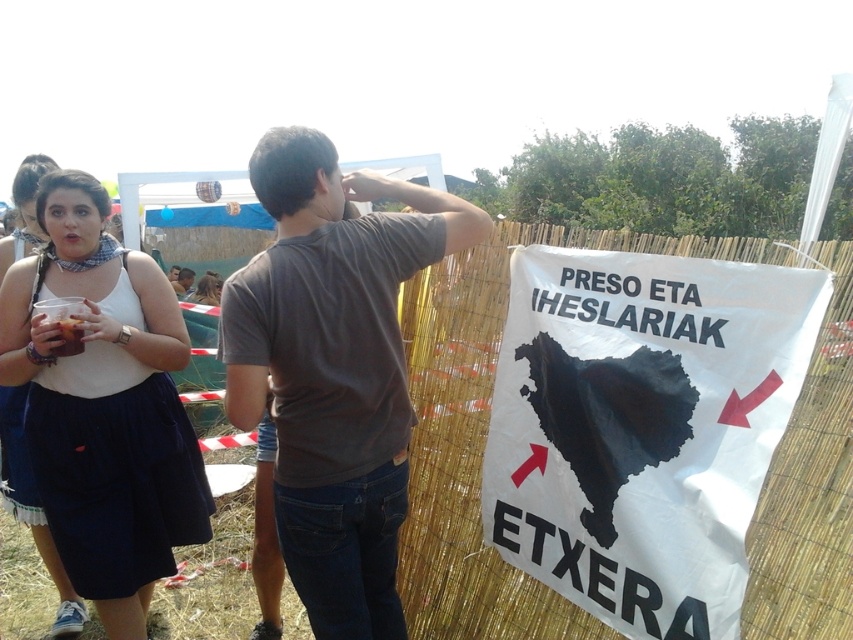
Is dark gray t-shirt at center behind white cotton tank top at left?

No.

Between point (302, 211) and point (26, 387), which one is positioned behind?

Point (26, 387)

Who is more distant from viewer, [445,240] or [33,244]?

The point [33,244] is more distant.

Where is `dark gray t-shirt at center`? Image resolution: width=853 pixels, height=640 pixels. dark gray t-shirt at center is located at coordinates (334, 369).

Who is more forward, [422,237] or [198,301]?

Point [422,237]

Measure the distance between point (270, 288) and camera.

Point (270, 288) and camera are 1.62 meters apart from each other.

Which is behind, point (270, 284) or point (218, 291)?

Point (218, 291)

Locate an element on the screen. The width and height of the screenshot is (853, 640). dark gray t-shirt at center is located at coordinates (334, 369).

Is dark gray t-shirt at center above matte brown shirt at center?

Actually, dark gray t-shirt at center is below matte brown shirt at center.

Is point (254, 376) closer to viewer compared to point (180, 288)?

Yes, it is in front of point (180, 288).

Does point (350, 305) lie in front of point (180, 280)?

Yes.

Image resolution: width=853 pixels, height=640 pixels. Find the location of `dark gray t-shirt at center`. dark gray t-shirt at center is located at coordinates (334, 369).